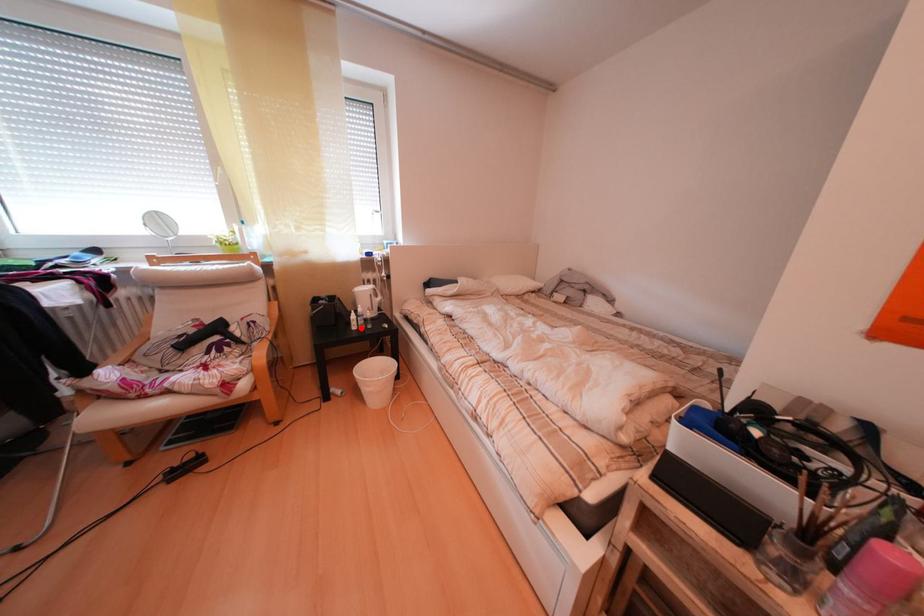
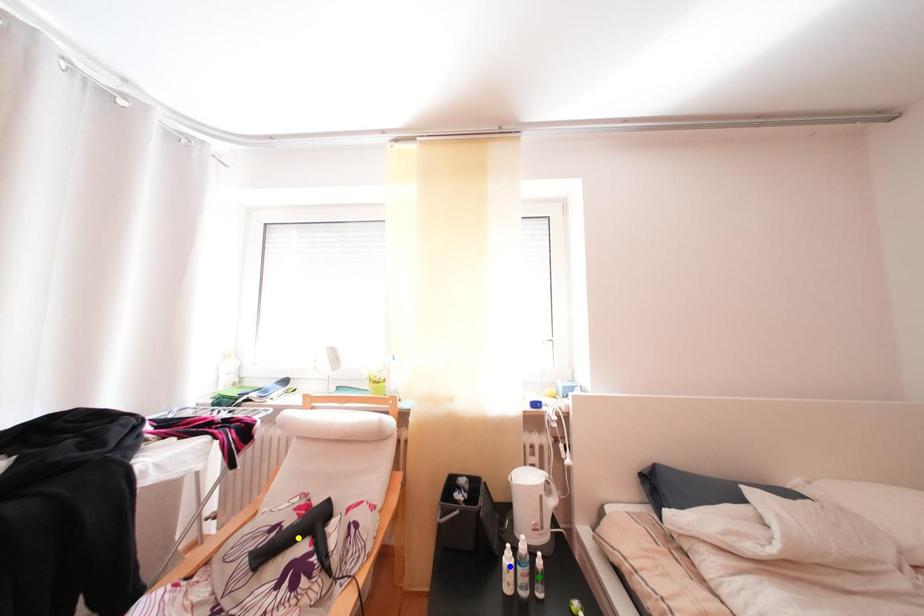
Question: I am providing you with two images of the same scene from different viewpoints. A red point is marked on the first image. You are given multiple points on the second image. Which spot in image 2 lines up with the point in image 1?

Choices:
 (A) blue point
 (B) yellow point
 (C) green point

Answer: (A)